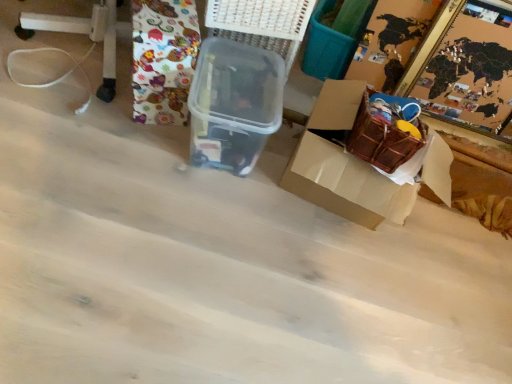
Question: Is transparent plastic container at center smaller than white plastic basket at upper center?

Choices:
 (A) yes
 (B) no

Answer: (B)

Question: Does transparent plastic container at center appear on the left side of white plastic basket at upper center?

Choices:
 (A) yes
 (B) no

Answer: (A)

Question: From a real-world perspective, is transparent plastic container at center beneath white plastic basket at upper center?

Choices:
 (A) no
 (B) yes

Answer: (B)

Question: Considering the relative sizes of transparent plastic container at center and white plastic basket at upper center in the image provided, is transparent plastic container at center thinner than white plastic basket at upper center?

Choices:
 (A) yes
 (B) no

Answer: (B)

Question: From the image's perspective, is transparent plastic container at center on top of white plastic basket at upper center?

Choices:
 (A) no
 (B) yes

Answer: (A)

Question: Is transparent plastic container at center turned away from white plastic basket at upper center?

Choices:
 (A) no
 (B) yes

Answer: (A)

Question: Does brown cardboard box at lower right lie behind patterned fabric at upper left?

Choices:
 (A) yes
 (B) no

Answer: (B)

Question: Would you consider brown cardboard box at lower right to be distant from patterned fabric at upper left?

Choices:
 (A) no
 (B) yes

Answer: (A)

Question: Can patterned fabric at upper left be found inside brown cardboard box at lower right?

Choices:
 (A) yes
 (B) no

Answer: (B)

Question: From a real-world perspective, is brown cardboard box at lower right positioned over patterned fabric at upper left based on gravity?

Choices:
 (A) no
 (B) yes

Answer: (A)

Question: Can you confirm if brown cardboard box at lower right is shorter than patterned fabric at upper left?

Choices:
 (A) no
 (B) yes

Answer: (B)

Question: Is patterned fabric at upper left at the back of brown cardboard box at lower right?

Choices:
 (A) no
 (B) yes

Answer: (A)

Question: Is transparent plastic container at center bigger than wooden puzzle frame at upper right?

Choices:
 (A) no
 (B) yes

Answer: (A)